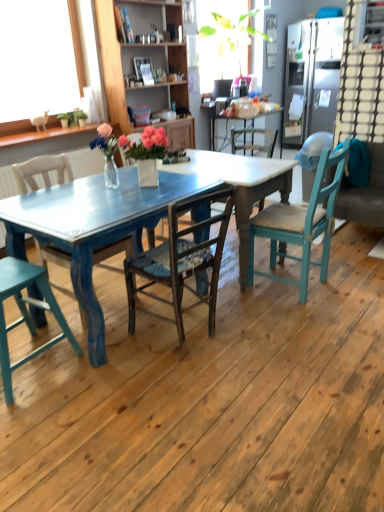
Question: Does point (196, 222) appear closer or farther from the camera than point (357, 216)?

Choices:
 (A) farther
 (B) closer

Answer: (B)

Question: Is wooden chair at center, acting as the second chair starting from the right, wider or thinner than teal fabric couch at right?

Choices:
 (A) thin
 (B) wide

Answer: (A)

Question: Estimate the real-world distances between objects in this image. Which object is farther from the satin silver refrigerator at upper right?

Choices:
 (A) wooden chair at center, positioned as the second chair in left-to-right order
 (B) wooden cabinet at upper center
 (C) wooden chair at center, which is counted as the 3th chair, starting from the left
 (D) teal fabric couch at right
 (E) teal wood chair at right, the 4th chair from the left

Answer: (A)

Question: Which object is positioned farthest from the wooden chair at center, positioned as the second chair in left-to-right order?

Choices:
 (A) teal fabric couch at right
 (B) satin silver refrigerator at upper right
 (C) wooden chair at center, which is counted as the 3th chair, starting from the left
 (D) wooden cabinet at upper center
 (E) teal wood chair at right, the 4th chair from the left

Answer: (B)